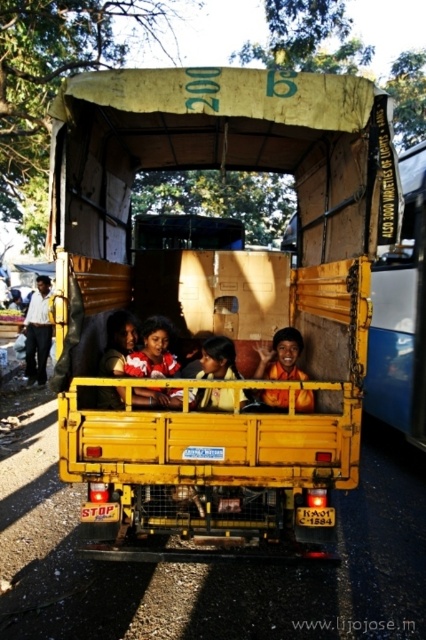
You are a photographer trying to capture the children in the cargo area of the yellow auto rickshaw. You notice the red and white striped shirt at center and the orange cloth at center. Which object should you focus on to ensure the subject is in the frame without worrying about the other object blocking it?

The red and white striped shirt at center might be wider than orange cloth at center, so focusing on the orange cloth at center would be better to avoid blocking by the wider shirt.